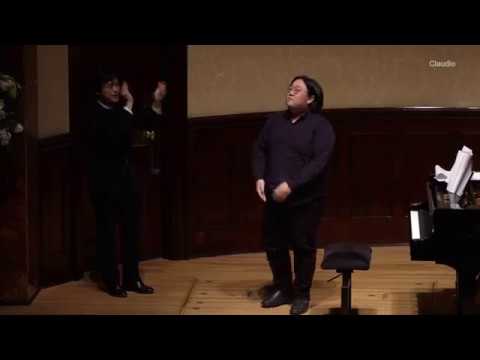
I want to click on wall, so click(217, 186).